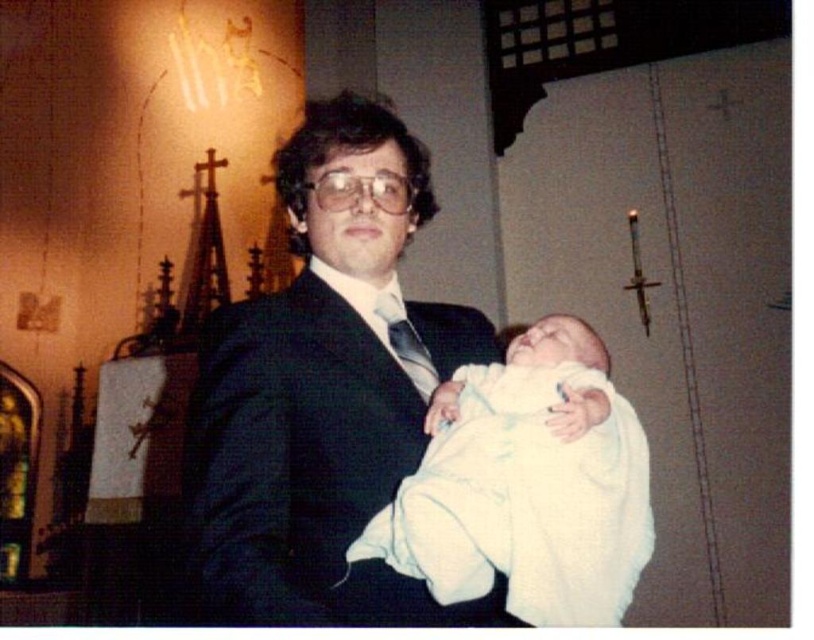
You are a photographer taking a portrait of the man and baby. The black satin suit at center and the white soft cloth at center are both in the frame. If your camera has a focus range of 8 inches, will both objects be in focus?

The black satin suit at center is 8.27 inches from the white soft cloth at center. Since the distance between them exceeds the camera focus range of 8 inches, they cannot both be in focus simultaneously.

You are standing in the church and want to move from point A to point B. Point A is at coordinate point(397, 241) and point B is at coordinate point(353, 548). Which point is closer to you?

Point A at coordinate point(397, 241) is closer to you because it is further to the viewer than point B at coordinate point(353, 548).